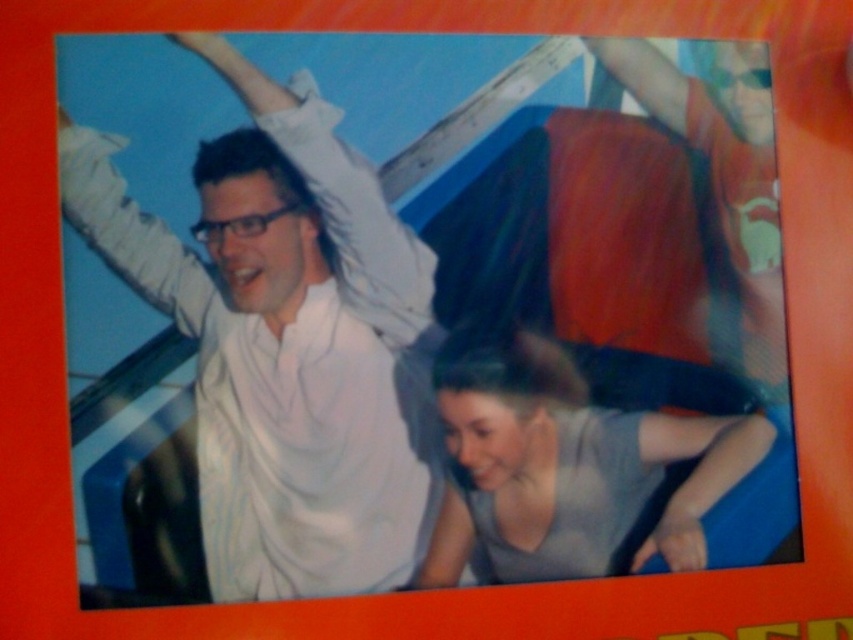
Consider the image. Which is above, gray matte shirt at lower center or smooth skin arm at lower right?

gray matte shirt at lower center is higher up.

Is point (560, 445) positioned behind point (704, 436)?

That is False.

You are a GUI agent. You are given a task and a screenshot of the screen. Output one action in this format:
    pyautogui.click(x=<x>, y=<y>)
    Task: Click on the gray matte shirt at lower center
    Image resolution: width=853 pixels, height=640 pixels.
    Given the screenshot: What is the action you would take?
    pyautogui.click(x=566, y=465)

Measure the distance between white matte shirt at upper left and white fabric arm at upper left.

white matte shirt at upper left is 4.36 inches away from white fabric arm at upper left.

Consider the image. Can you confirm if white matte shirt at upper left is positioned below white fabric arm at upper left?

No.

Is point (326, 189) farther from viewer compared to point (196, 282)?

Yes, point (326, 189) is farther from viewer.

This screenshot has height=640, width=853. Identify the location of white matte shirt at upper left. (334, 188).

Which of these two, white fabric arm at upper left or smooth skin arm at lower right, stands shorter?

smooth skin arm at lower right is shorter.

Between white fabric arm at upper left and smooth skin arm at lower right, which one has more height?

white fabric arm at upper left

Between point (183, 244) and point (677, 538), which one is positioned in front?

Point (183, 244)

Locate an element on the screen. white fabric arm at upper left is located at coordinates (129, 228).